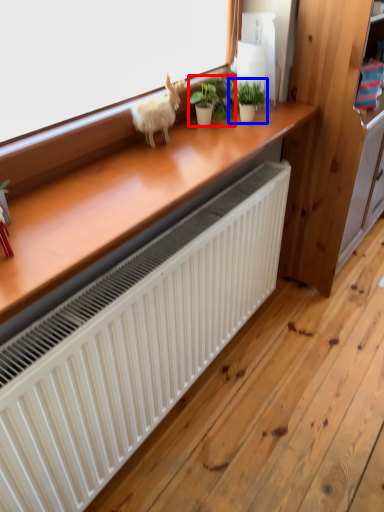
Question: Which object is closer to the camera taking this photo, houseplant (highlighted by a red box) or houseplant (highlighted by a blue box)?

Choices:
 (A) houseplant
 (B) houseplant

Answer: (B)